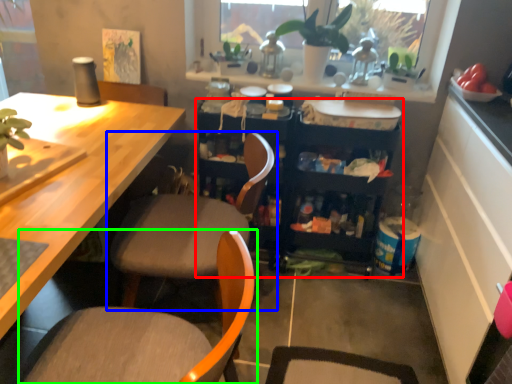
Question: Based on their relative distances, which object is nearer to cabinetry (highlighted by a red box)? Choose from chair (highlighted by a blue box) and chair (highlighted by a green box).

Choices:
 (A) chair
 (B) chair

Answer: (A)